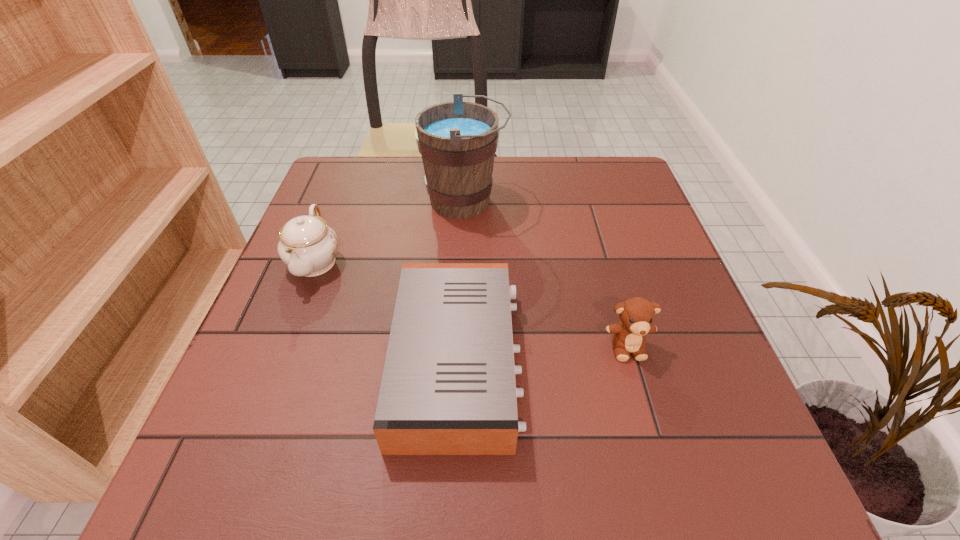
Image resolution: width=960 pixels, height=540 pixels. I want to click on the tallest object, so click(x=457, y=140).

I want to click on wine bucket, so click(x=457, y=140).

You are a GUI agent. You are given a task and a screenshot of the screen. Output one action in this format:
    pyautogui.click(x=<x>, y=<y>)
    Task: Click on the chinaware
    This screenshot has width=960, height=540.
    Given the screenshot: What is the action you would take?
    [308, 246]

Where is `the leftmost object`? The width and height of the screenshot is (960, 540). the leftmost object is located at coordinates (308, 246).

Locate an element on the screen. the rightmost object is located at coordinates (637, 314).

The height and width of the screenshot is (540, 960). Find the location of `radio receiver`. radio receiver is located at coordinates (448, 387).

Find the location of a particular element. The width and height of the screenshot is (960, 540). vacant space located 0.130m with a handle on the side of the wine bucket is located at coordinates (558, 201).

I want to click on vacant space located 0.160m at the spout of the chinaware, so (x=278, y=356).

Where is `vacant area situated 0.110m on the face of the teddy bear`? The image size is (960, 540). vacant area situated 0.110m on the face of the teddy bear is located at coordinates (648, 420).

Locate an element on the screen. This screenshot has height=540, width=960. free space located 0.180m on the control panel of the shortest object is located at coordinates (620, 361).